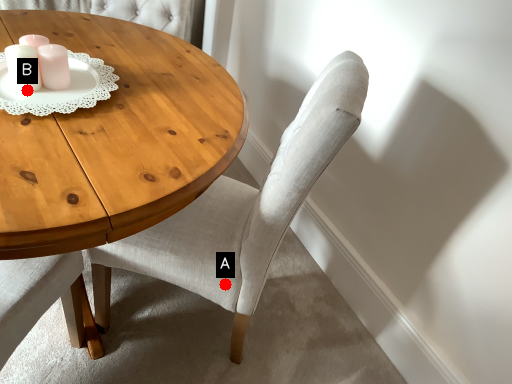
Question: Two points are circled on the image, labeled by A and B beside each circle. Which point is closer to the camera taking this photo?

Choices:
 (A) A is closer
 (B) B is closer

Answer: (B)